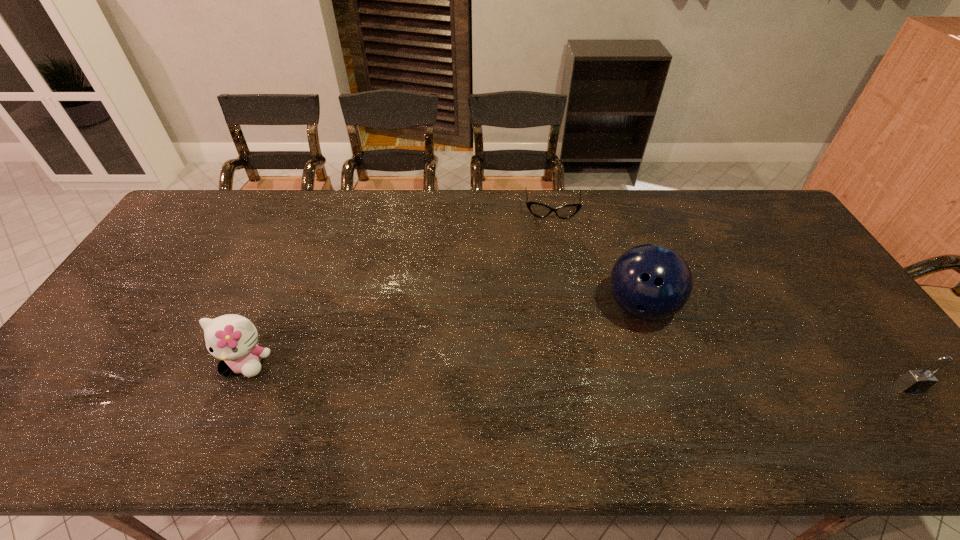
Locate an element on the screen. The width and height of the screenshot is (960, 540). free point at the far edge is located at coordinates (695, 203).

The width and height of the screenshot is (960, 540). Identify the location of vacant space at the near edge of the desktop. (515, 383).

In the image, there is a desktop. Identify the location of free space at the right edge. (874, 344).

You are a GUI agent. You are given a task and a screenshot of the screen. Output one action in this format:
    pyautogui.click(x=<x>, y=<y>)
    Task: Click on the free spot between the shortest object and the third shortest object
    Image resolution: width=960 pixels, height=540 pixels.
    Given the screenshot: What is the action you would take?
    pyautogui.click(x=399, y=286)

The image size is (960, 540). I want to click on vacant area that lies between the second tallest object and the second farthest object, so click(444, 335).

Identify the location of free area in between the third tallest object and the tallest object. (775, 347).

In order to click on vacant point located between the shortest object and the tallest object in this screenshot , I will do `click(596, 259)`.

Where is `free space between the shortest object and the padlock`? free space between the shortest object and the padlock is located at coordinates (731, 299).

Find the location of a particular element. free space between the second farthest object and the third tallest object is located at coordinates (775, 347).

In order to click on empty location between the kitten and the spectacles in this screenshot , I will do `click(399, 286)`.